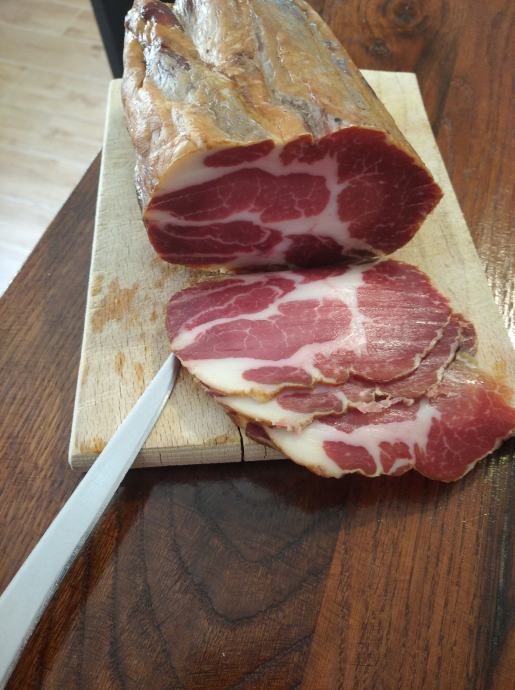
Identify the location of countertop. This screenshot has width=515, height=690. (338, 628).